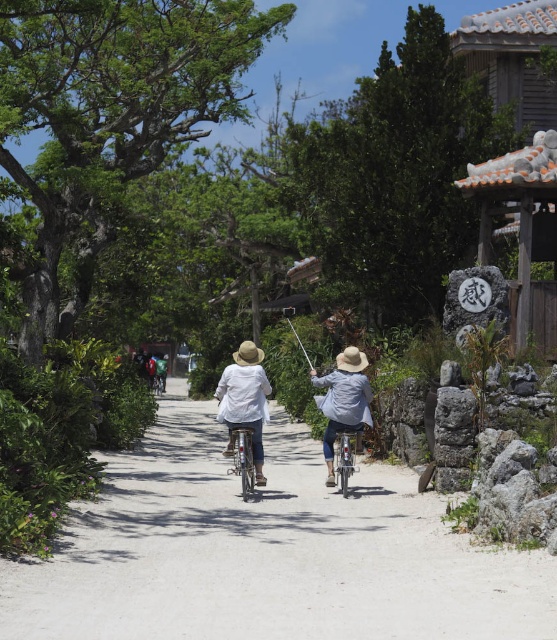
Is point (246, 374) positioned after point (158, 372)?

That is False.

Can you confirm if white cotton shirt at center is shorter than green fabric jacket at center?

In fact, white cotton shirt at center may be taller than green fabric jacket at center.

The width and height of the screenshot is (557, 640). I want to click on white cotton shirt at center, so click(x=245, y=401).

Is green fabric backpack at center to the left of metallic silver fishing pole at center from the viewer's perspective?

Correct, you'll find green fabric backpack at center to the left of metallic silver fishing pole at center.

Is green fabric backpack at center shorter than metallic silver fishing pole at center?

Incorrect, green fabric backpack at center's height does not fall short of metallic silver fishing pole at center's.

Which is in front, point (157, 376) or point (296, 337)?

Point (296, 337)

Find the location of a particular element. Image resolution: width=557 pixels, height=640 pixels. green fabric backpack at center is located at coordinates (150, 368).

Can you confirm if light blue denim jeans at center is positioned above green fabric backpack at center?

Correct, light blue denim jeans at center is located above green fabric backpack at center.

The width and height of the screenshot is (557, 640). What do you see at coordinates (344, 401) in the screenshot? I see `light blue denim jeans at center` at bounding box center [344, 401].

Identify the location of light blue denim jeans at center. (344, 401).